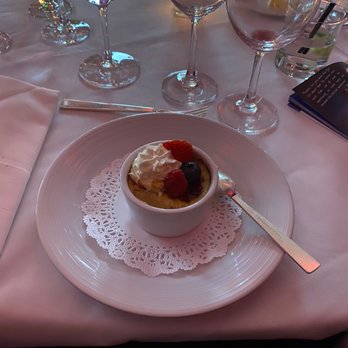
Identify the location of book. Image resolution: width=348 pixels, height=348 pixels. (329, 111).